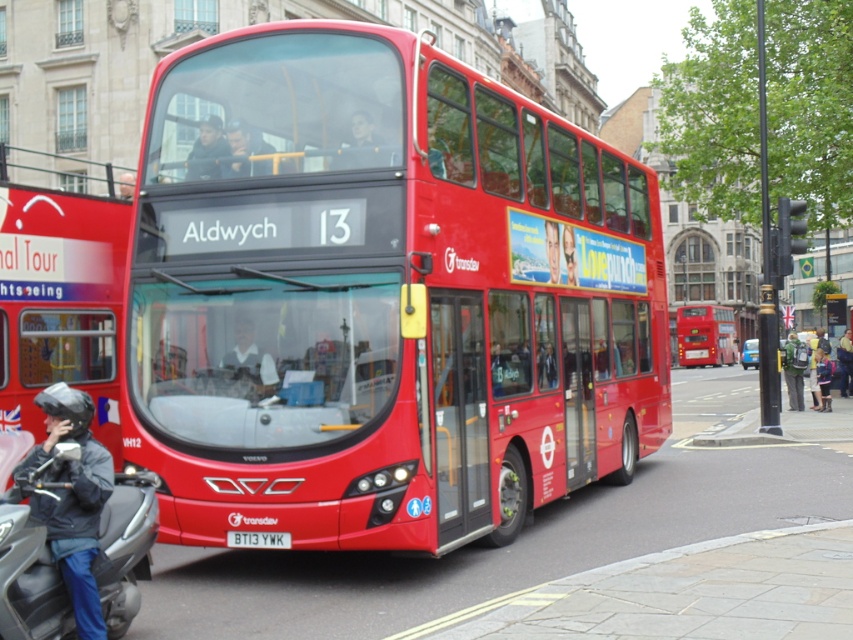
Question: Which of the following is the closest to the observer?

Choices:
 (A) (242, 532)
 (B) (32, 419)
 (C) (495, 260)
 (D) (718, 324)

Answer: (A)

Question: Can you confirm if shiny red bus at center is positioned above matte red bus at left?

Choices:
 (A) yes
 (B) no

Answer: (B)

Question: Does matte red bus at center come in front of white plastic license plate at center?

Choices:
 (A) yes
 (B) no

Answer: (B)

Question: Which object is the farthest from the matte red bus at left?

Choices:
 (A) white plastic license plate at center
 (B) shiny red bus at center
 (C) matte red bus at center

Answer: (C)

Question: Does shiny red bus at center have a smaller size compared to matte red bus at center?

Choices:
 (A) yes
 (B) no

Answer: (A)

Question: Among these points, which one is nearest to the camera?

Choices:
 (A) (51, 403)
 (B) (715, 317)

Answer: (A)